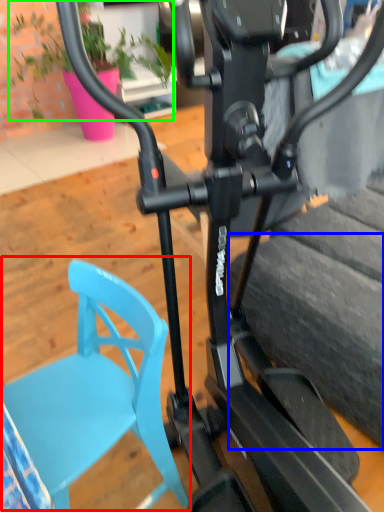
Question: Which object is the closest to the swivel chair (highlighted by a red box)? Choose among these: tire (highlighted by a blue box) or plant (highlighted by a green box).

Choices:
 (A) tire
 (B) plant

Answer: (A)